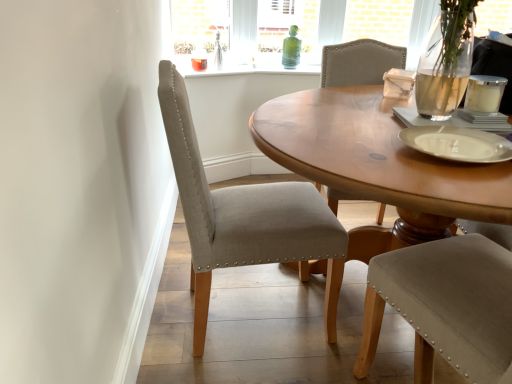
Question: Is beige fabric chair at center inside the boundaries of white matte platter at right, or outside?

Choices:
 (A) inside
 (B) outside

Answer: (B)

Question: From a real-world perspective, is beige fabric chair at center positioned above or below white matte platter at right?

Choices:
 (A) above
 (B) below

Answer: (B)

Question: Looking at the image, does beige fabric chair at center seem bigger or smaller compared to white matte platter at right?

Choices:
 (A) small
 (B) big

Answer: (B)

Question: Is point (486, 160) closer or farther from the camera than point (196, 243)?

Choices:
 (A) closer
 (B) farther

Answer: (A)

Question: From a real-world perspective, is white matte platter at right positioned above or below beige fabric chair at center?

Choices:
 (A) below
 (B) above

Answer: (B)

Question: From the image's perspective, is white matte platter at right located above or below beige fabric chair at center?

Choices:
 (A) above
 (B) below

Answer: (A)

Question: Is white matte platter at right wider or thinner than beige fabric chair at center?

Choices:
 (A) thin
 (B) wide

Answer: (A)